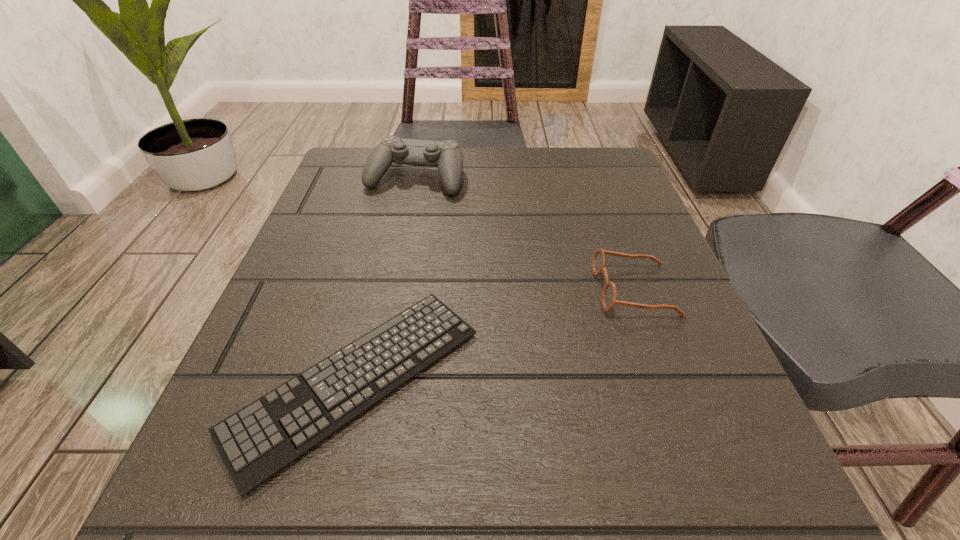
Identify the location of control. (447, 156).

The height and width of the screenshot is (540, 960). Identify the location of the farthest object. (447, 156).

Where is `the second tallest object`? This screenshot has width=960, height=540. the second tallest object is located at coordinates (608, 297).

Identify the location of spectacles. The height and width of the screenshot is (540, 960). (608, 297).

In order to click on computer keyboard in this screenshot , I will do `click(256, 442)`.

Locate an element on the screen. vacant space positioned 0.110m on the right of the control is located at coordinates (515, 178).

Image resolution: width=960 pixels, height=540 pixels. Find the location of `vacant space situated 0.330m on the front-facing side of the second tallest object`. vacant space situated 0.330m on the front-facing side of the second tallest object is located at coordinates (391, 289).

The image size is (960, 540). Identify the location of vacant space located on the front-facing side of the second tallest object. (546, 289).

Locate an element on the screen. vacant space located on the front-facing side of the second tallest object is located at coordinates [x=360, y=289].

Locate an element on the screen. Image resolution: width=960 pixels, height=540 pixels. vacant space located on the back of the shortest object is located at coordinates (400, 197).